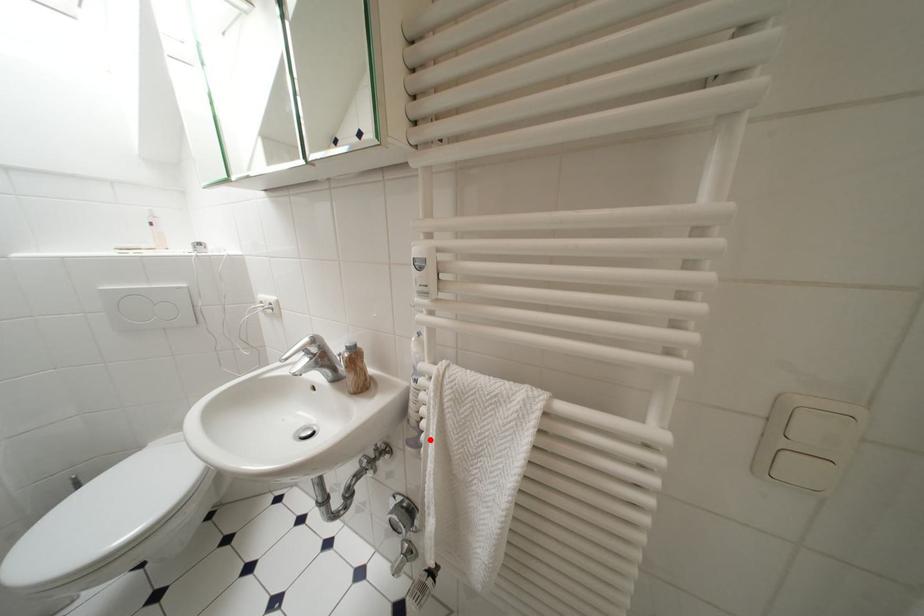
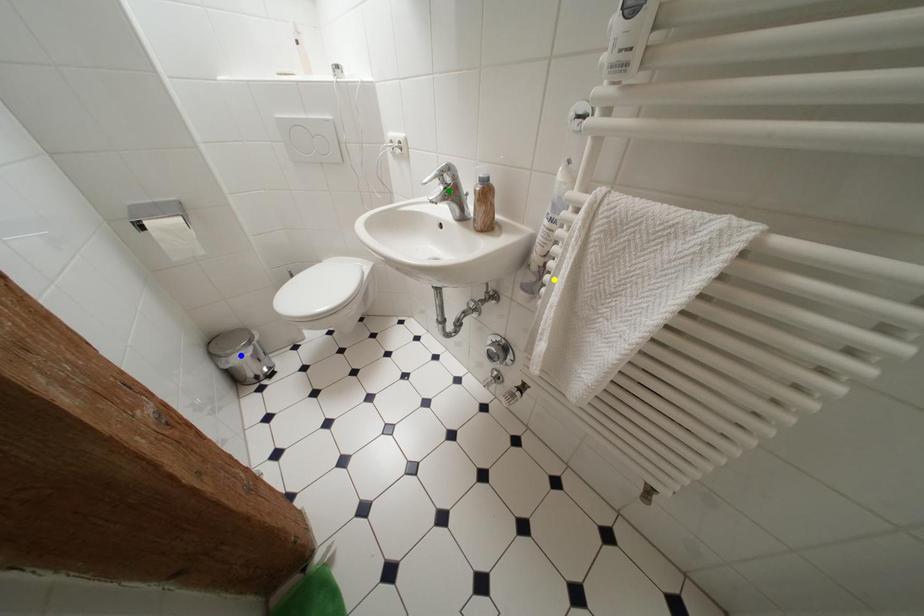
Question: I am providing you with two images of the same scene from different viewpoints. A red point is marked on the first image. You are given multiple points on the second image. In image 2, which mark is for the same physical point as the one in image 1?

Choices:
 (A) yellow point
 (B) blue point
 (C) green point

Answer: (A)